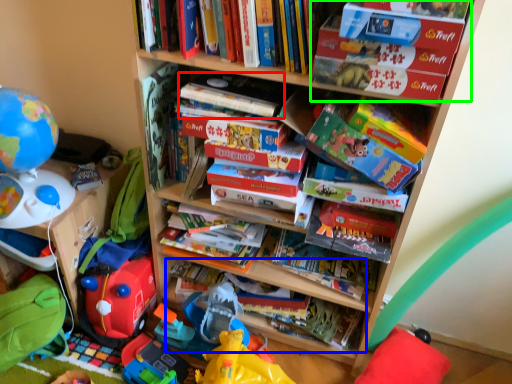
Question: Which object is positioned closest to paperback book (highlighted by a red box)? Select from book (highlighted by a blue box) and book (highlighted by a green box).

Choices:
 (A) book
 (B) book

Answer: (B)